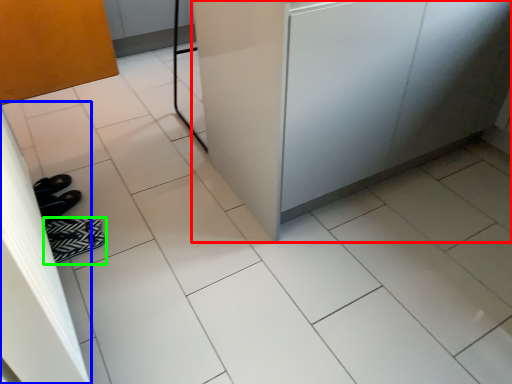
Question: Based on their relative distances, which object is farther from counter (highlighted by a red box)? Choose from screen door (highlighted by a blue box) and footwear (highlighted by a green box).

Choices:
 (A) screen door
 (B) footwear

Answer: (B)